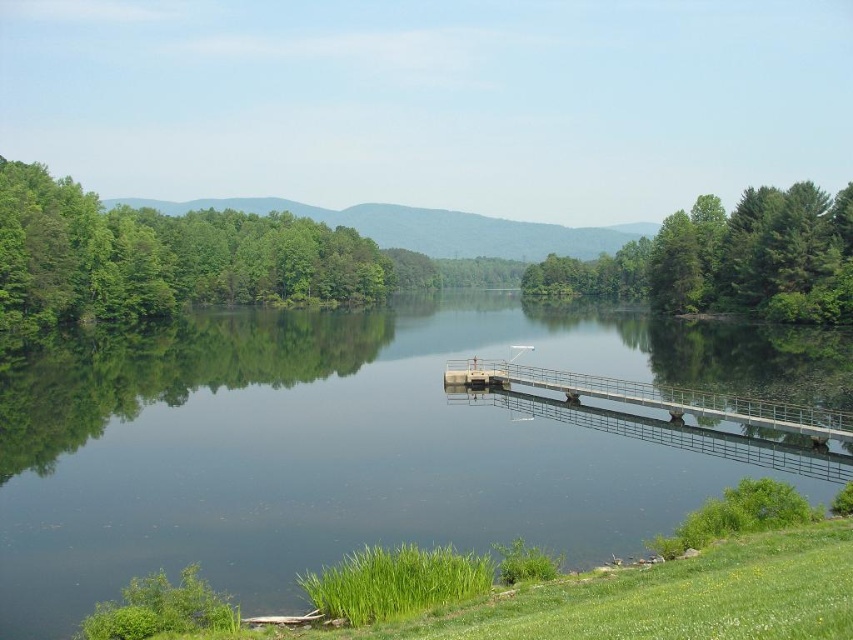
In the scene shown: Is clear glass water at center above metallic gray bridge at center?

Yes, clear glass water at center is above metallic gray bridge at center.

Looking at this image, does clear glass water at center have a lesser height compared to metallic gray bridge at center?

No.

This screenshot has width=853, height=640. Identify the location of clear glass water at center. (360, 444).

In order to click on green leafy tree at right in this screenshot , I will do `click(727, 259)`.

Does green leafy tree at right have a larger size compared to metallic gray bridge at center?

Indeed, green leafy tree at right has a larger size compared to metallic gray bridge at center.

Is point (715, 236) less distant than point (694, 451)?

No, (715, 236) is behind (694, 451).

Identify the location of green leafy tree at right. (727, 259).

Can you confirm if clear glass water at center is positioned above green leafy tree at right?

Incorrect, clear glass water at center is not positioned above green leafy tree at right.

The height and width of the screenshot is (640, 853). What do you see at coordinates (360, 444) in the screenshot?
I see `clear glass water at center` at bounding box center [360, 444].

Does point (103, 595) come behind point (715, 241)?

No, it is in front of (715, 241).

You are a GUI agent. You are given a task and a screenshot of the screen. Output one action in this format:
    pyautogui.click(x=<x>, y=<y>)
    Task: Click on the clear glass water at center
    This screenshot has height=640, width=853.
    Given the screenshot: What is the action you would take?
    pyautogui.click(x=360, y=444)